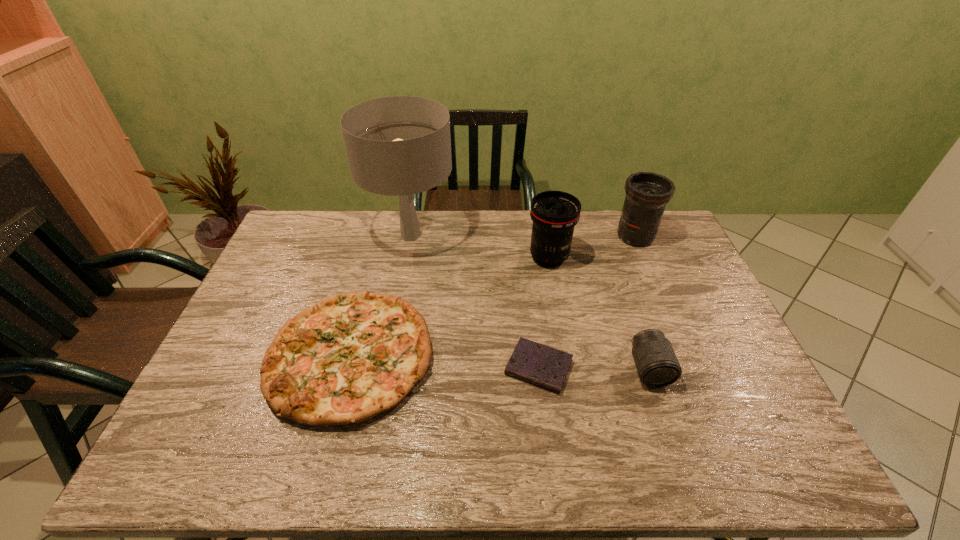
Locate an element on the screen. The image size is (960, 540). lampshade is located at coordinates (401, 145).

In order to click on the leftmost telephoto lens in this screenshot , I will do [x=554, y=214].

At what (x,y) coordinates should I click in order to perform the action: click on the third shortest object. Please return your answer as a coordinate pair (x, y). This screenshot has width=960, height=540. Looking at the image, I should click on (657, 366).

At what (x,y) coordinates should I click in order to perform the action: click on the shortest telephoto lens. Please return your answer as a coordinate pair (x, y). This screenshot has width=960, height=540. Looking at the image, I should click on (657, 366).

This screenshot has width=960, height=540. Identify the location of pizza. (350, 357).

The image size is (960, 540). What are the coordinates of `the shortest object` in the screenshot? It's located at 538,364.

At what (x,y) coordinates should I click in order to perform the action: click on free space located on the front-facing side of the lampshade. Please return your answer as a coordinate pair (x, y). The width and height of the screenshot is (960, 540). Looking at the image, I should click on (554, 235).

Identify the location of vacant region located 0.220m on the front of the leftmost telephoto lens. pos(561,323).

Locate an element on the screen. vacant point located 0.140m on the surface of the nearest telephoto lens is located at coordinates (674, 441).

I want to click on vacant space positioned 0.060m on the front of the fifth tallest object, so click(324, 455).